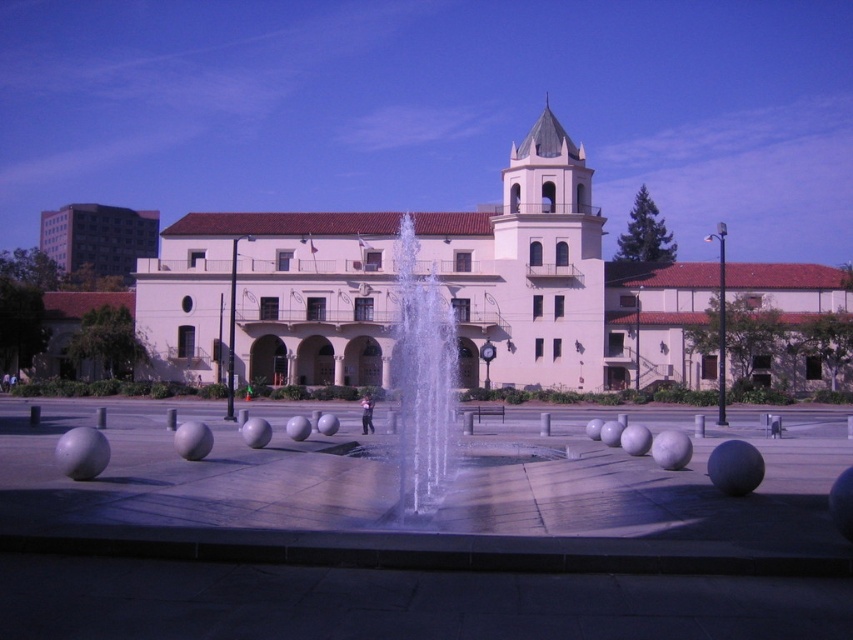
Can you confirm if white stucco building at center is smaller than clear glass water at center?

No.

Which is in front, point (318, 280) or point (440, 410)?

Point (440, 410) is in front.

Locate an element on the screen. The image size is (853, 640). white stucco building at center is located at coordinates (273, 296).